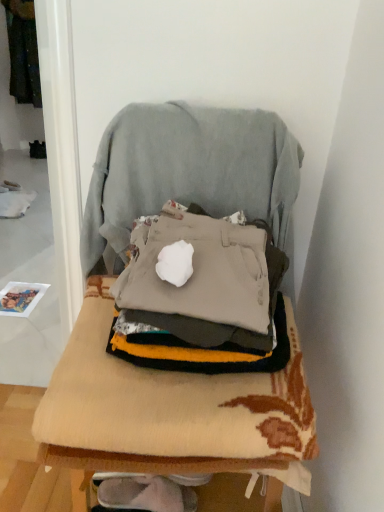
Question: From a real-world perspective, is light gray fabric swivel chair at center physically above beige fabric chair at center?

Choices:
 (A) no
 (B) yes

Answer: (B)

Question: Is light gray fabric swivel chair at center in contact with beige fabric chair at center?

Choices:
 (A) yes
 (B) no

Answer: (A)

Question: Does light gray fabric swivel chair at center have a greater height compared to beige fabric chair at center?

Choices:
 (A) no
 (B) yes

Answer: (A)

Question: From a real-world perspective, is light gray fabric swivel chair at center beneath beige fabric chair at center?

Choices:
 (A) no
 (B) yes

Answer: (A)

Question: Is the depth of light gray fabric swivel chair at center less than that of beige fabric chair at center?

Choices:
 (A) no
 (B) yes

Answer: (A)

Question: In terms of size, does beige fabric chair at center appear bigger or smaller than light gray fabric swivel chair at center?

Choices:
 (A) big
 (B) small

Answer: (A)

Question: From a real-world perspective, relative to light gray fabric swivel chair at center, is beige fabric chair at center vertically above or below?

Choices:
 (A) above
 (B) below

Answer: (B)

Question: In the image, is beige fabric chair at center positioned in front of or behind light gray fabric swivel chair at center?

Choices:
 (A) behind
 (B) front

Answer: (B)

Question: Considering the positions of beige fabric chair at center and light gray fabric swivel chair at center in the image, is beige fabric chair at center taller or shorter than light gray fabric swivel chair at center?

Choices:
 (A) short
 (B) tall

Answer: (B)

Question: Is dark green fabric at upper left to the left or to the right of light gray fabric swivel chair at center in the image?

Choices:
 (A) right
 (B) left

Answer: (B)

Question: Is dark green fabric at upper left spatially inside light gray fabric swivel chair at center, or outside of it?

Choices:
 (A) inside
 (B) outside

Answer: (B)

Question: Considering their positions, is dark green fabric at upper left located in front of or behind light gray fabric swivel chair at center?

Choices:
 (A) behind
 (B) front

Answer: (A)

Question: From a real-world perspective, relative to light gray fabric swivel chair at center, is dark green fabric at upper left vertically above or below?

Choices:
 (A) above
 (B) below

Answer: (A)

Question: Considering the positions of beige knitted blanket at center and light gray fabric swivel chair at center in the image, is beige knitted blanket at center taller or shorter than light gray fabric swivel chair at center?

Choices:
 (A) tall
 (B) short

Answer: (B)

Question: Is beige knitted blanket at center inside or outside of light gray fabric swivel chair at center?

Choices:
 (A) outside
 (B) inside

Answer: (A)